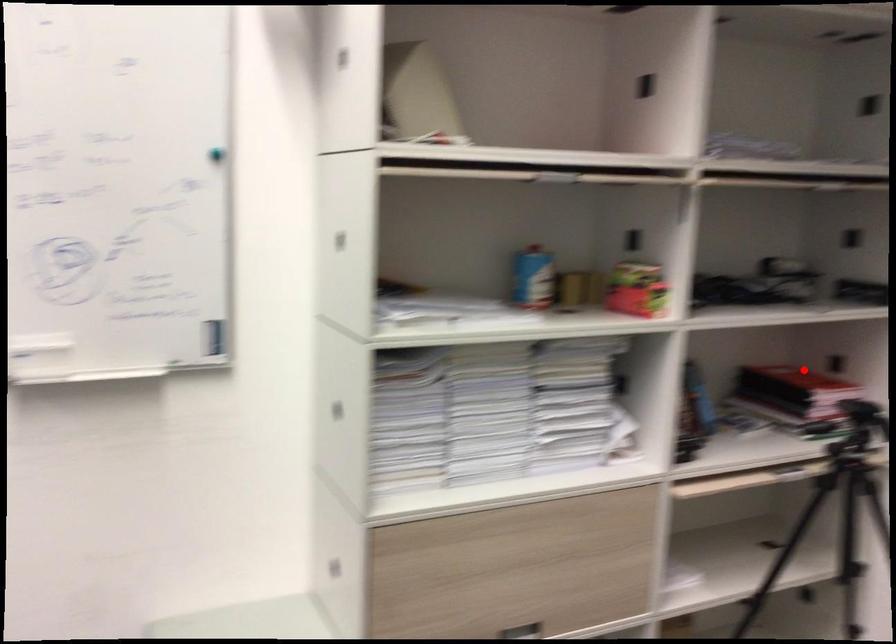
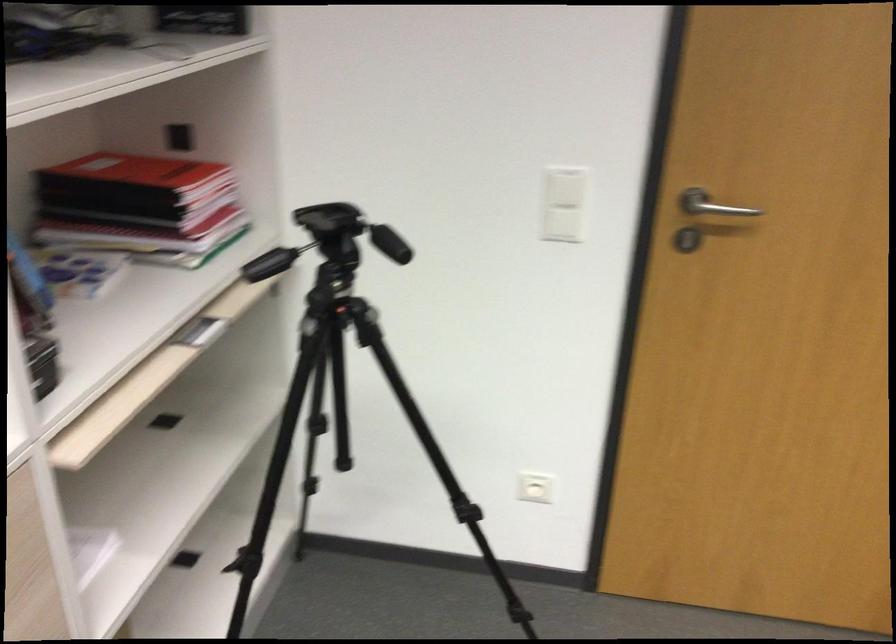
Where in the second image is the point corresponding to the highlighted location from the first image?

(133, 172)